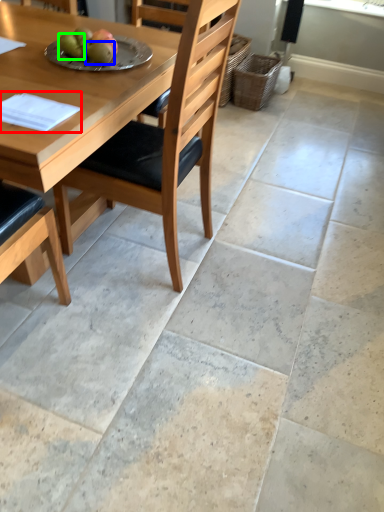
Question: Based on their relative distances, which object is farther from pad (highlighted by a red box)? Choose from fruit (highlighted by a blue box) and fruit (highlighted by a green box).

Choices:
 (A) fruit
 (B) fruit

Answer: (B)